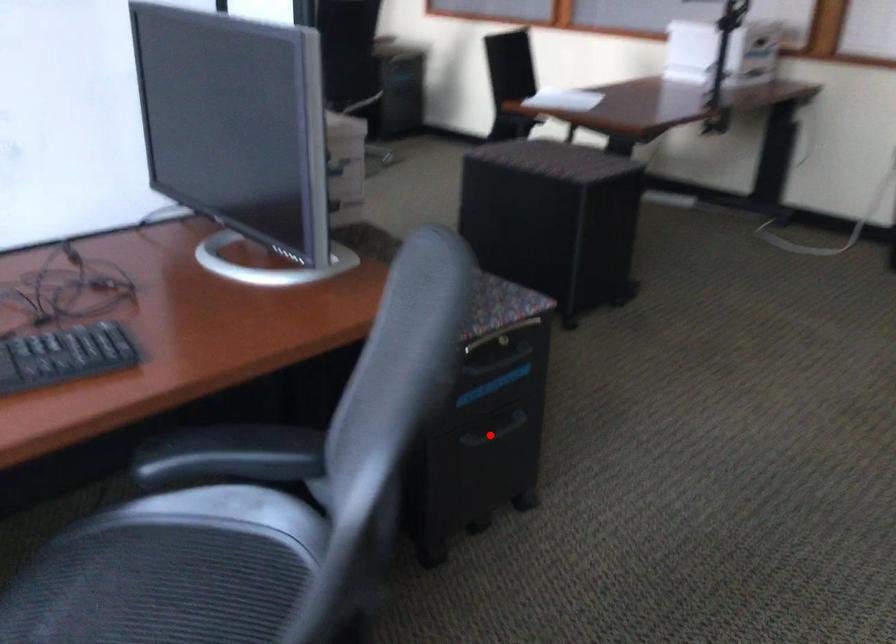
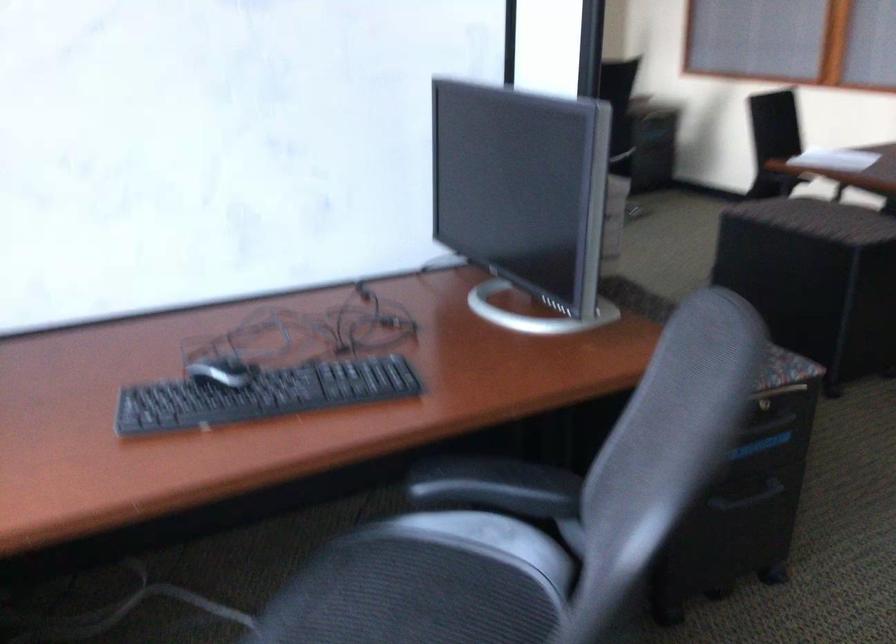
Question: I am providing you with two images of the same scene from different viewpoints. A red point is marked on the first image. Is the red point's position out of view in image 2?

Choices:
 (A) Yes
 (B) No

Answer: (B)